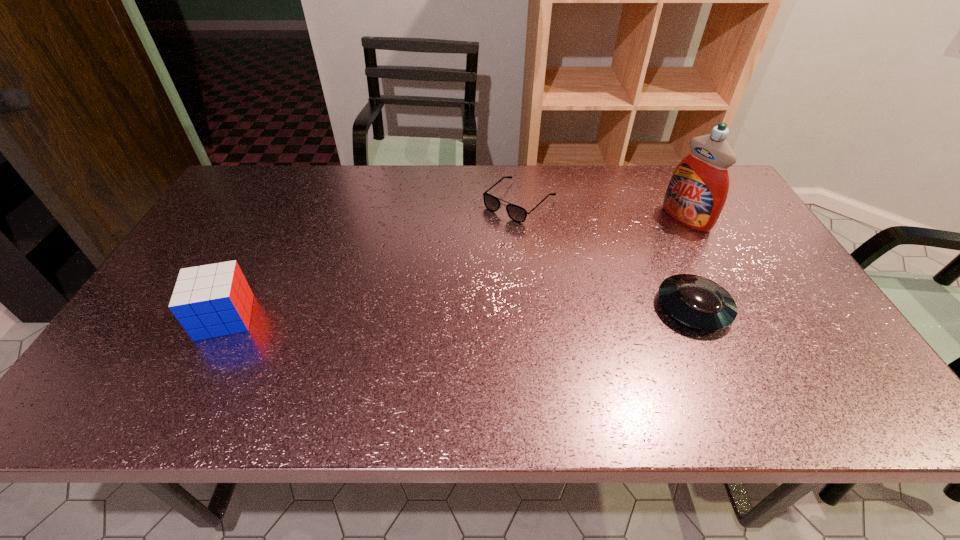
Identify the location of vacant space on the desktop that is between the leftmost object and the saucer and is positioned on the front-facing side of the second object from left to right. This screenshot has width=960, height=540. (393, 314).

Where is `free space on the desktop that is between the third shortest object and the saucer and is positioned on the front surface of the detergent`? The height and width of the screenshot is (540, 960). free space on the desktop that is between the third shortest object and the saucer and is positioned on the front surface of the detergent is located at coordinates (524, 311).